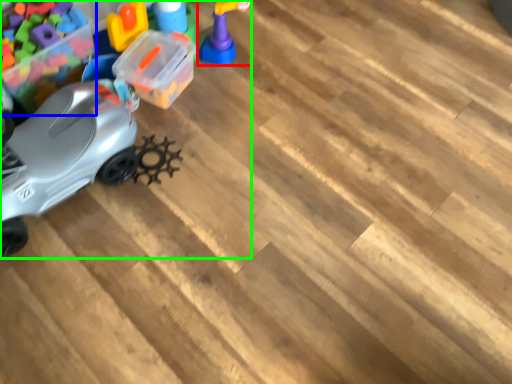
Question: Which object is the farthest from toy (highlighted by a red box)? Choose among these: toy (highlighted by a blue box) or toy (highlighted by a green box).

Choices:
 (A) toy
 (B) toy

Answer: (A)